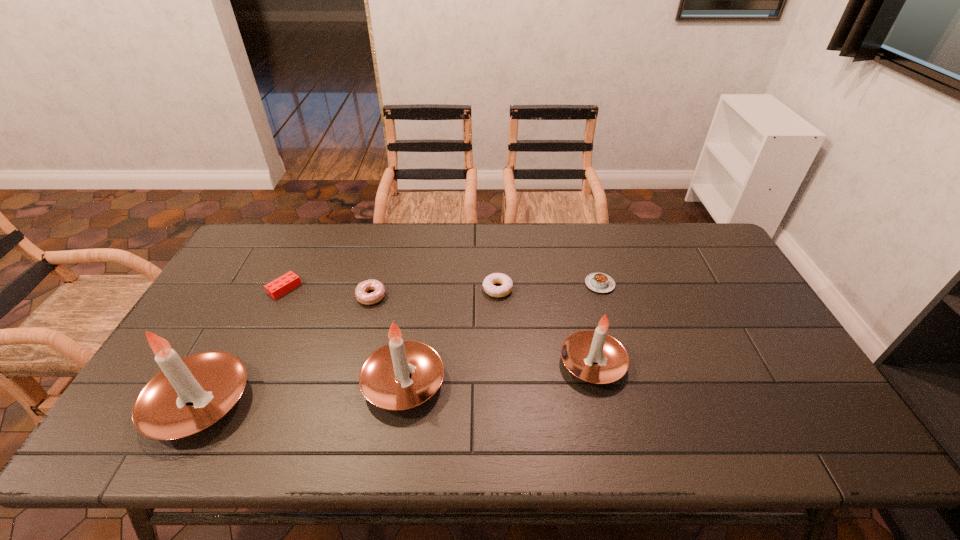
Please show where to add a candle on the right while keeping spacing even. Please provide its 2D coordinates. Your answer should be formatted as a tuple, i.e. [(x, y)], where the tuple contains the x and y coordinates of a point satisfying the conditions above.

[(768, 346)]